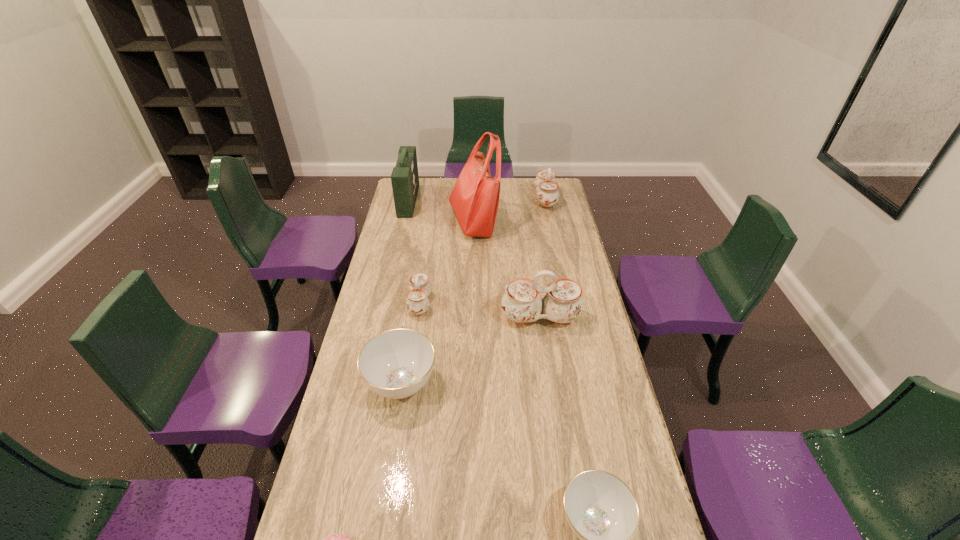
Select which object appears as the third closest to the shortest chinaware. Please provide its 2D coordinates. Your answer should be formatted as a tuple, i.e. [(x, y)], where the tuple contains the x and y coordinates of a point satisfying the conditions above.

[(562, 303)]

Choose which object is the sixth nearest neighbor to the biggest white chinaware. Please provide its 2D coordinates. Your answer should be formatted as a tuple, i.e. [(x, y)], where the tuple contains the x and y coordinates of a point satisfying the conditions above.

[(405, 180)]

Point out which chinaware is positioned as the nearest to the pink doughnut. Please provide its 2D coordinates. Your answer should be formatted as a tuple, i.e. [(x, y)], where the tuple contains the x and y coordinates of a point satisfying the conditions above.

[(395, 364)]

Identify which chinaware is located as the third nearest to the seventh tallest object. Please provide its 2D coordinates. Your answer should be formatted as a tuple, i.e. [(x, y)], where the tuple contains the x and y coordinates of a point satisfying the conditions above.

[(420, 287)]

The image size is (960, 540). I want to click on the second closest white chinaware to the tallest chinaware, so click(545, 184).

I want to click on white chinaware that is the second closest one to the nearest chinaware, so click(x=420, y=287).

Locate an element on the screen. The width and height of the screenshot is (960, 540). free space that satisfies the following two spatial constraints: 1. by the handle of the leftmost white chinaware; 2. on the front side of the farther gray chinaware is located at coordinates [x=408, y=383].